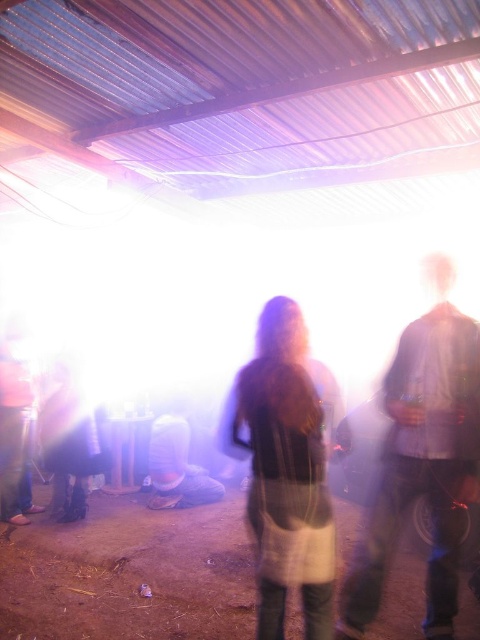
This screenshot has height=640, width=480. I want to click on light brown fabric dress at center, so click(284, 467).

Is light brown fabric dress at center closer to camera compared to shiny black boots at lower left?

That is True.

Is point (327, 518) less distant than point (78, 492)?

Yes, point (327, 518) is closer to viewer.

The width and height of the screenshot is (480, 640). Identify the location of light brown fabric dress at center. (284, 467).

Which is behind, point (309, 385) or point (24, 420)?

Positioned behind is point (24, 420).

Who is taller, light brown fabric dress at center or matte black pants at left?

light brown fabric dress at center is taller.

Locate an element on the screen. The height and width of the screenshot is (640, 480). light brown fabric dress at center is located at coordinates (284, 467).

You are a GUI agent. You are given a task and a screenshot of the screen. Output one action in this format:
    pyautogui.click(x=<x>, y=<y>)
    Task: Click on the matte black jacket at center
    
    Given the screenshot: What is the action you would take?
    pyautogui.click(x=423, y=458)

Does matte black jacket at center have a smaller size compared to shiny black boots at lower left?

No.

At what (x,y) coordinates should I click in order to perform the action: click on matte black jacket at center. Please return your answer as a coordinate pair (x, y). Looking at the image, I should click on (423, 458).

This screenshot has height=640, width=480. I want to click on matte black jacket at center, so click(x=423, y=458).